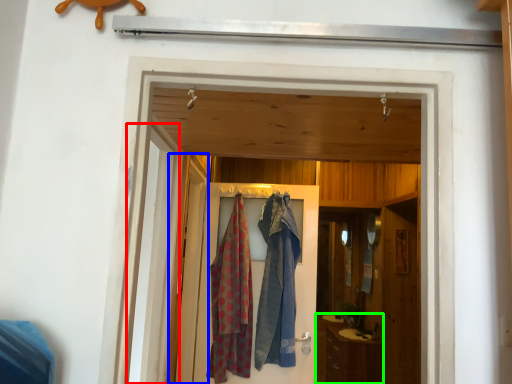
Question: Which object is positioned farthest from screen door (highlighted by a red box)? Select from screen door (highlighted by a blue box) and cabinetry (highlighted by a green box).

Choices:
 (A) screen door
 (B) cabinetry

Answer: (B)